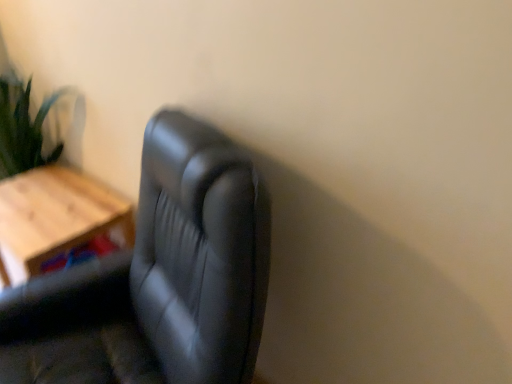
Question: Does wooden table at left have a smaller size compared to black leather chair at center?

Choices:
 (A) yes
 (B) no

Answer: (A)

Question: Considering the relative sizes of wooden table at left and black leather chair at center in the image provided, is wooden table at left thinner than black leather chair at center?

Choices:
 (A) no
 (B) yes

Answer: (B)

Question: Considering the relative sizes of wooden table at left and black leather chair at center in the image provided, is wooden table at left shorter than black leather chair at center?

Choices:
 (A) yes
 (B) no

Answer: (A)

Question: Would you say wooden table at left is a long distance from black leather chair at center?

Choices:
 (A) yes
 (B) no

Answer: (B)

Question: Can you confirm if wooden table at left is taller than black leather chair at center?

Choices:
 (A) no
 (B) yes

Answer: (A)

Question: Considering the relative sizes of wooden table at left and black leather chair at center in the image provided, is wooden table at left bigger than black leather chair at center?

Choices:
 (A) yes
 (B) no

Answer: (B)

Question: Does black leather chair at center appear on the right side of wooden table at left?

Choices:
 (A) yes
 (B) no

Answer: (A)

Question: Considering the relative sizes of black leather chair at center and wooden table at left in the image provided, is black leather chair at center taller than wooden table at left?

Choices:
 (A) no
 (B) yes

Answer: (B)

Question: From a real-world perspective, is black leather chair at center below wooden table at left?

Choices:
 (A) yes
 (B) no

Answer: (B)

Question: Would you say wooden table at left is part of black leather chair at center's contents?

Choices:
 (A) no
 (B) yes

Answer: (A)

Question: From a real-world perspective, is black leather chair at center positioned over wooden table at left based on gravity?

Choices:
 (A) no
 (B) yes

Answer: (B)

Question: Considering the relative sizes of black leather chair at center and wooden table at left in the image provided, is black leather chair at center bigger than wooden table at left?

Choices:
 (A) yes
 (B) no

Answer: (A)

Question: From a real-world perspective, is black leather chair at center physically located above or below wooden table at left?

Choices:
 (A) below
 (B) above

Answer: (B)